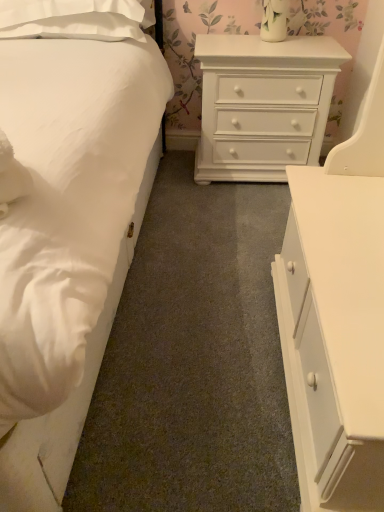
Question: Which direction should I rotate to look at white painted wood chest of drawers at center, arranged as the second chest of drawers when viewed from the front, — up or down?

Choices:
 (A) up
 (B) down

Answer: (A)

Question: Is white glossy chest of drawers at upper center, the second chest of drawers from the back, to the left of white painted wood chest of drawers at center, arranged as the second chest of drawers when viewed from the front, from the viewer's perspective?

Choices:
 (A) yes
 (B) no

Answer: (B)

Question: Is white glossy chest of drawers at upper center, which ranks as the first chest of drawers in front-to-back order, smaller than white painted wood chest of drawers at center, arranged as the second chest of drawers when viewed from the front?

Choices:
 (A) yes
 (B) no

Answer: (B)

Question: Is white glossy chest of drawers at upper center, the second chest of drawers from the back, surrounding white painted wood chest of drawers at center, arranged as the 1th chest of drawers when viewed from the back?

Choices:
 (A) no
 (B) yes

Answer: (A)

Question: Does white glossy chest of drawers at upper center, which ranks as the first chest of drawers in front-to-back order, appear on the right side of white painted wood chest of drawers at center, arranged as the 1th chest of drawers when viewed from the back?

Choices:
 (A) no
 (B) yes

Answer: (B)

Question: Is white glossy chest of drawers at upper center, which ranks as the first chest of drawers in front-to-back order, aimed at white painted wood chest of drawers at center, arranged as the 1th chest of drawers when viewed from the back?

Choices:
 (A) yes
 (B) no

Answer: (B)

Question: From the image's perspective, is white glossy chest of drawers at upper center, which ranks as the first chest of drawers in front-to-back order, above white painted wood chest of drawers at center, arranged as the 1th chest of drawers when viewed from the back?

Choices:
 (A) no
 (B) yes

Answer: (A)

Question: Is white glossy chest of drawers at upper center, the second chest of drawers from the back, at the right side of white smooth bed at left?

Choices:
 (A) yes
 (B) no

Answer: (A)

Question: Is white glossy chest of drawers at upper center, the second chest of drawers from the back, looking in the opposite direction of white smooth bed at left?

Choices:
 (A) yes
 (B) no

Answer: (B)

Question: Is white glossy chest of drawers at upper center, the second chest of drawers from the back, thinner than white smooth bed at left?

Choices:
 (A) yes
 (B) no

Answer: (A)

Question: Are white glossy chest of drawers at upper center, which ranks as the first chest of drawers in front-to-back order, and white smooth bed at left making contact?

Choices:
 (A) yes
 (B) no

Answer: (B)

Question: From a real-world perspective, is white glossy chest of drawers at upper center, which ranks as the first chest of drawers in front-to-back order, under white smooth bed at left?

Choices:
 (A) yes
 (B) no

Answer: (B)

Question: Is white glossy chest of drawers at upper center, the second chest of drawers from the back, positioned behind white smooth bed at left?

Choices:
 (A) no
 (B) yes

Answer: (B)

Question: Is white painted wood chest of drawers at center, arranged as the second chest of drawers when viewed from the front, located outside white smooth bed at left?

Choices:
 (A) yes
 (B) no

Answer: (A)